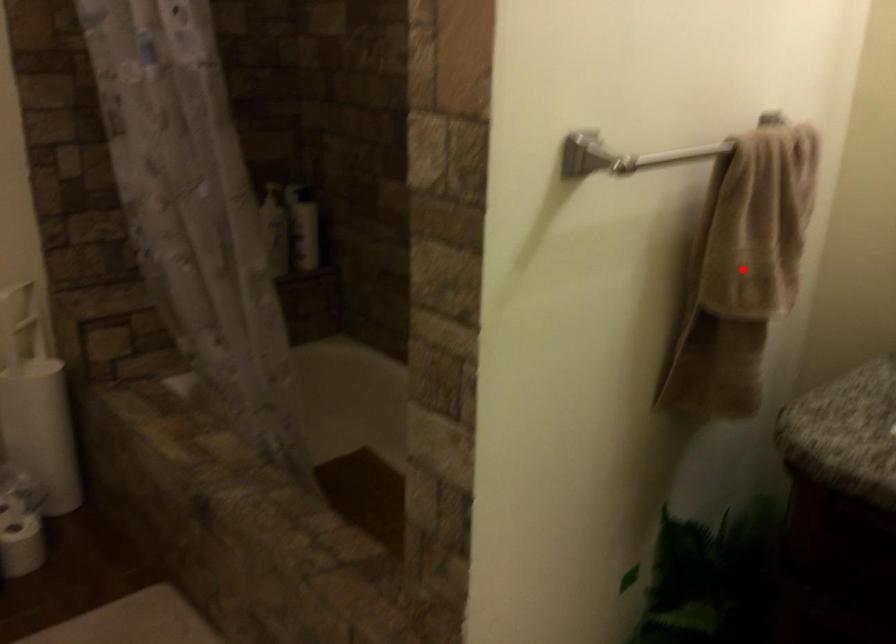
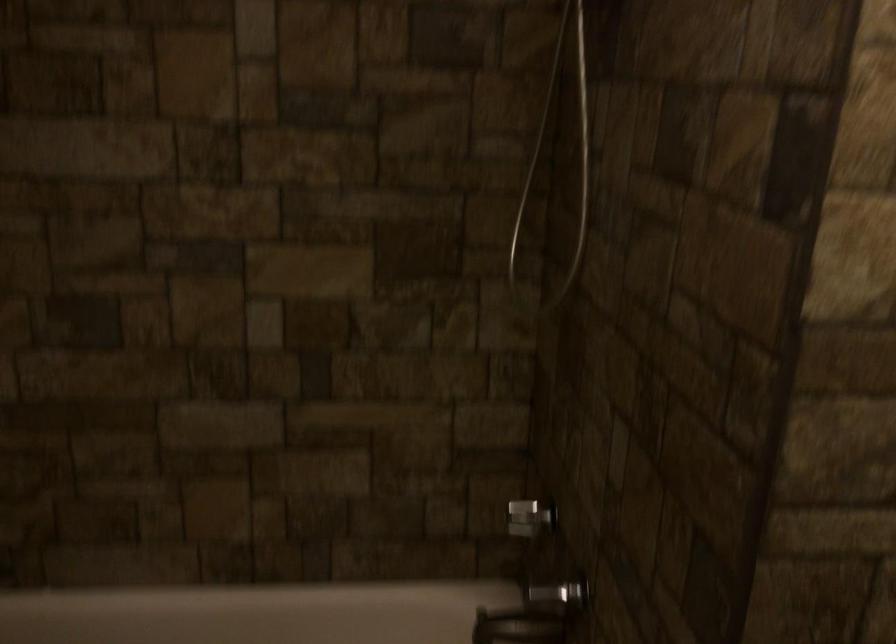
Question: I am providing you with two images of the same scene from different viewpoints. A red point is marked on the first image. Can you still see the location of the red point in image 2?

Choices:
 (A) Yes
 (B) No

Answer: (B)